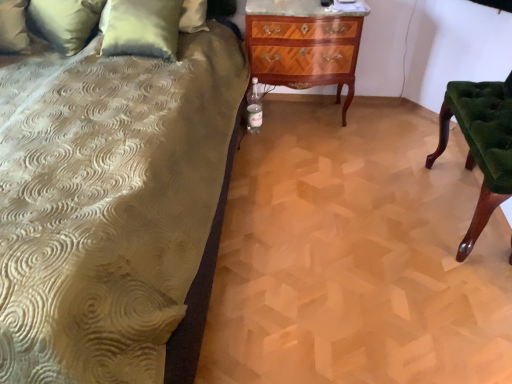
In order to click on free spot in front of green velvet chair at right in this screenshot , I will do `click(443, 278)`.